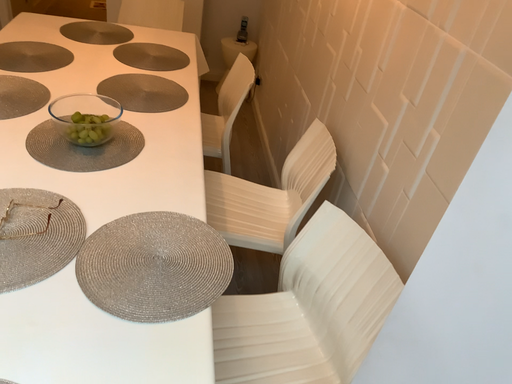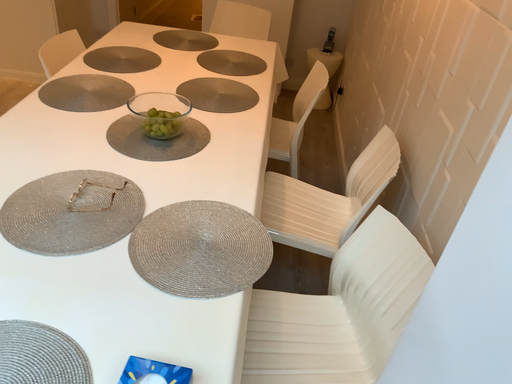
Question: How did the camera likely rotate when shooting the video?

Choices:
 (A) rotated left
 (B) rotated right

Answer: (A)